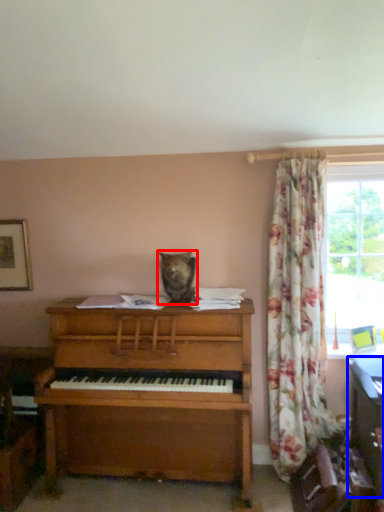
Question: Among these objects, which one is farthest to the camera, animal (highlighted by a red box) or computer desk (highlighted by a blue box)?

Choices:
 (A) animal
 (B) computer desk

Answer: (A)